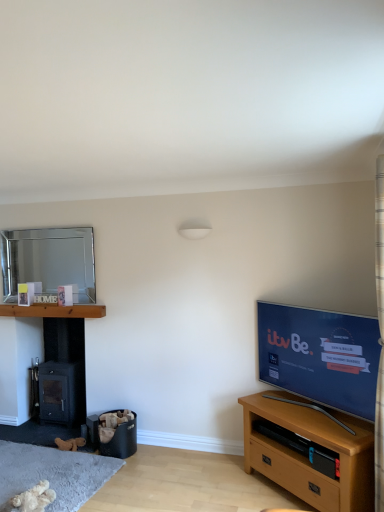
The width and height of the screenshot is (384, 512). What are the coordinates of `empty space that is ontop of silver metallic mirror at upper left (from a real-world perspective)` in the screenshot? It's located at (51, 224).